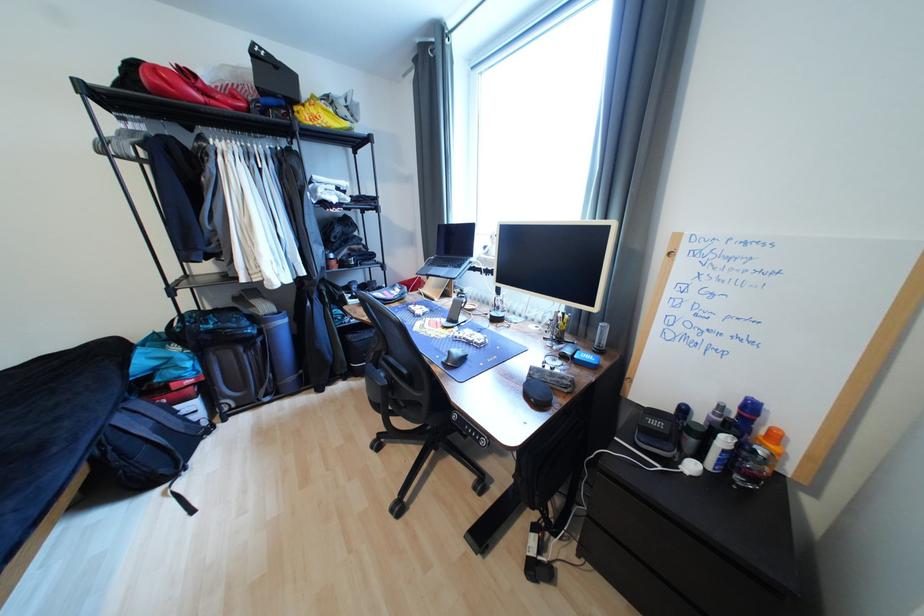
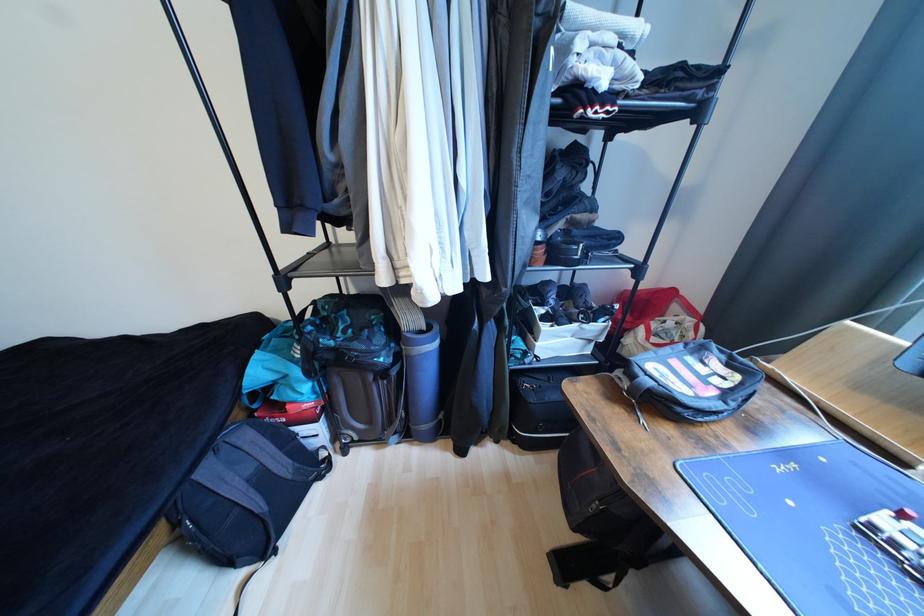
Where in the second image is the point corresponding to point 128,421 from the first image?

(215, 472)